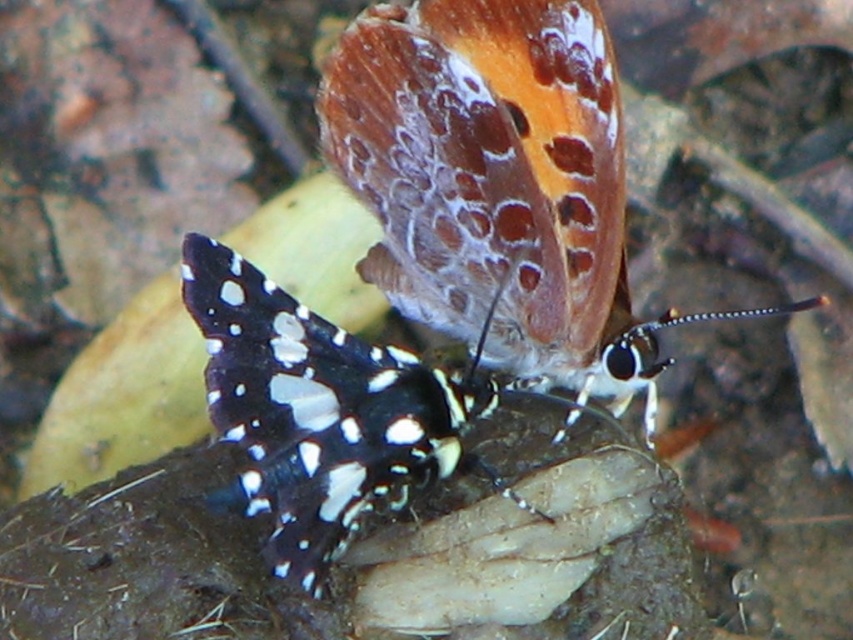
Where is `translucent orange butterfly at upper center`? The image size is (853, 640). translucent orange butterfly at upper center is located at coordinates (498, 186).

Measure the distance between point (421, 113) and camera.

Point (421, 113) is 1.33 meters away from camera.

Locate an element on the screen. This screenshot has height=640, width=853. translucent orange butterfly at upper center is located at coordinates (498, 186).

Image resolution: width=853 pixels, height=640 pixels. I want to click on translucent orange butterfly at upper center, so click(x=498, y=186).